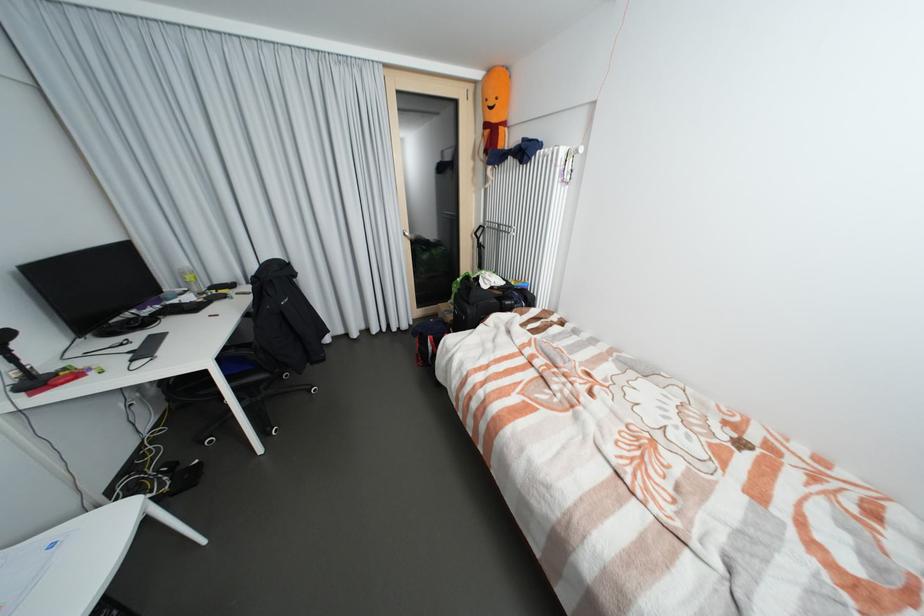
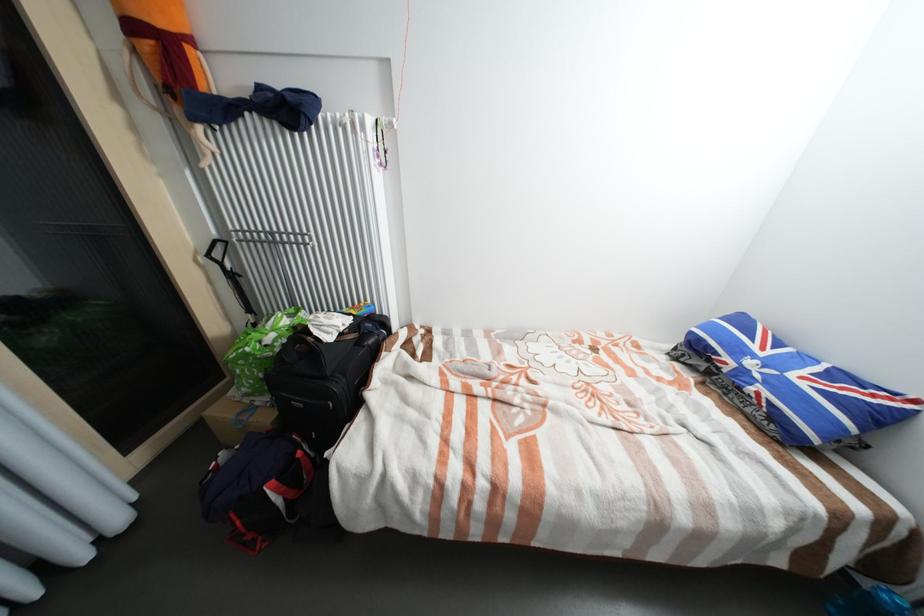
Locate, in the second image, the point that corresponds to (499,288) in the first image.

(348, 334)